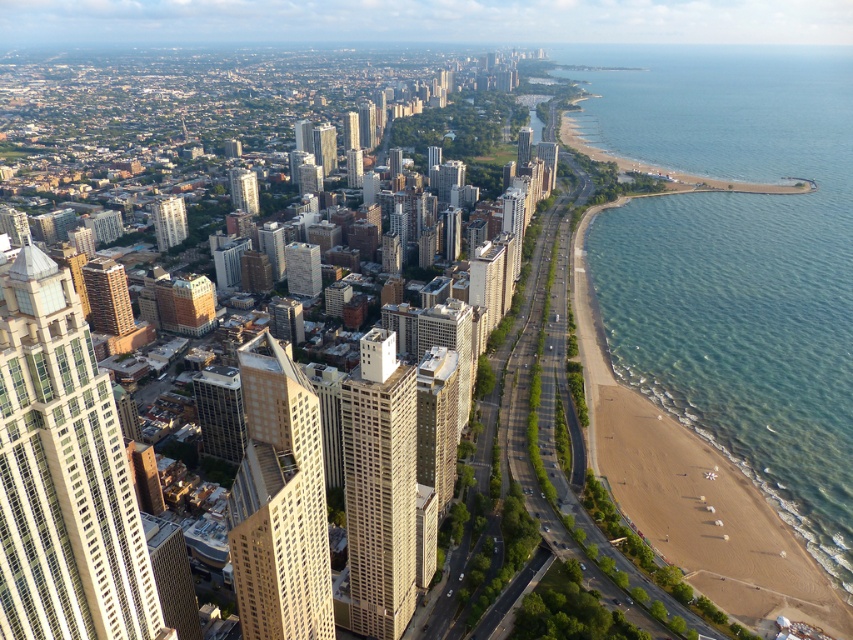
Question: Which object is the closest to the matte glass skyscraper at upper left?

Choices:
 (A) beige concrete building at center-left
 (B) beige concrete building at center
 (C) gold glass skyscraper at center

Answer: (A)

Question: Is beige concrete building at center to the left of beige concrete building at center-left from the viewer's perspective?

Choices:
 (A) no
 (B) yes

Answer: (A)

Question: Which point is closer to the camera?

Choices:
 (A) (825, 68)
 (B) (250, 609)
 (C) (183, 227)

Answer: (B)

Question: Can you confirm if matte glass skyscraper at upper left is wider than gold glass skyscraper at center?

Choices:
 (A) no
 (B) yes

Answer: (B)

Question: Which object appears farthest from the camera in this image?

Choices:
 (A) brown brick building at center-left
 (B) beige concrete building at center-left
 (C) beige textured building at center

Answer: (B)

Question: Is beige glass skyscraper at center-left wider than beige concrete building at center-left?

Choices:
 (A) no
 (B) yes

Answer: (B)